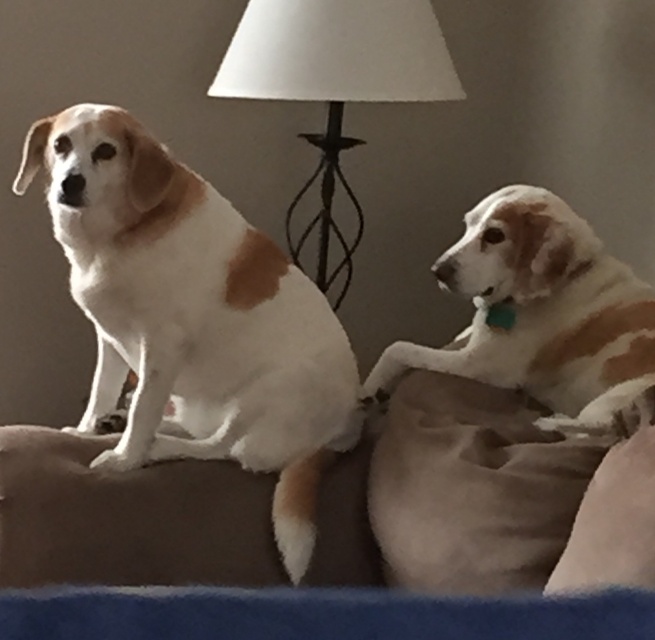
Does white fur dog at left appear under soft suede pillow at lower right?

No, white fur dog at left is not below soft suede pillow at lower right.

Describe the element at coordinates (193, 317) in the screenshot. I see `white fur dog at left` at that location.

You are a GUI agent. You are given a task and a screenshot of the screen. Output one action in this format:
    pyautogui.click(x=<x>, y=<y>)
    Task: Click on the white fur dog at left
    Image resolution: width=655 pixels, height=640 pixels.
    Given the screenshot: What is the action you would take?
    pyautogui.click(x=193, y=317)

Can you confirm if white fur dog at left is bigger than white matte lampshade at center?

Correct, white fur dog at left is larger in size than white matte lampshade at center.

Is point (293, 385) more distant than point (326, 42)?

No, (293, 385) is in front of (326, 42).

I want to click on white fur dog at left, so click(193, 317).

Between point (75, 161) and point (627, 621), which one is positioned in front?

Point (627, 621)

Between white fur dog at left and blue fabric dog bed at lower center, which one is positioned lower?

blue fabric dog bed at lower center

In the scene shown: Who is more forward, (320, 381) or (631, 611)?

Positioned in front is point (631, 611).

Where is `white fur dog at left`? The height and width of the screenshot is (640, 655). white fur dog at left is located at coordinates (193, 317).